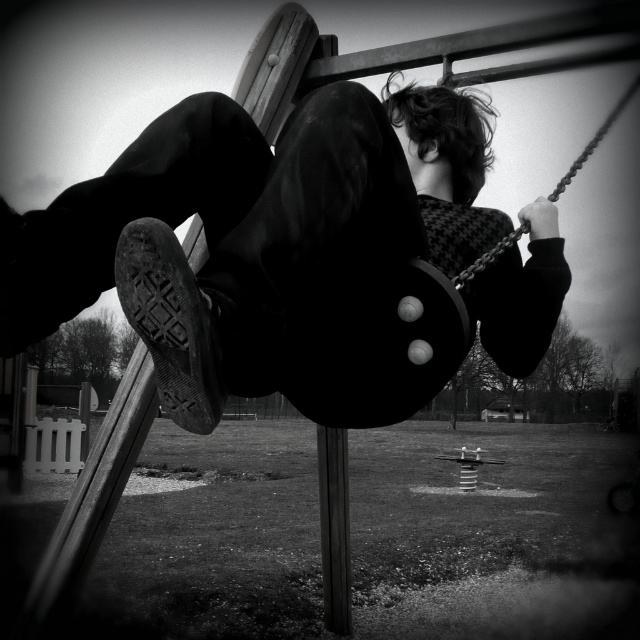
You are a playground inspector checking safety distances. According to regulations, the distance between the dark fabric pants at center and the smooth wood pole at center must be at least 5 feet. Is the current distance compliant?

The dark fabric pants at center is 6.24 feet from the smooth wood pole at center, which exceeds the minimum required distance of 5 feet. Therefore, the current distance is compliant with safety regulations.

You are a photographer trying to capture the perfect shot of the dark fabric pants at center and the smooth wood pole at center. Based on their sizes, which object should you focus on first if you want to ensure both are in frame without zooming in or out?

The dark fabric pants at center is not as tall as the smooth wood pole at center, so you should focus on the smooth wood pole at center first to ensure both fit in the frame.

You are standing at the playground and want to place a small flag exactly halfway between point [212,252] and point [344,477]. Which direction should you move from the closer point to reach the halfway point?

The halfway point between point [212,252] and point [344,477] is located towards the direction of point [344,477] from the closer point [212,252].